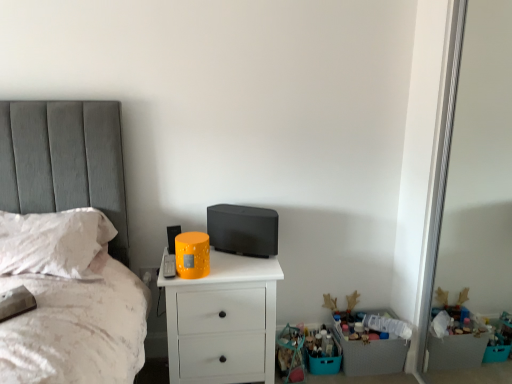
Question: From a real-world perspective, relative to white matte chest of drawers at center, is white soft pillow at left vertically above or below?

Choices:
 (A) above
 (B) below

Answer: (A)

Question: From the image's perspective, is white soft pillow at left located above or below white matte chest of drawers at center?

Choices:
 (A) below
 (B) above

Answer: (B)

Question: Estimate the real-world distances between objects in this image. Which object is farther from the plastic crate at lower right?

Choices:
 (A) white soft pillow at left
 (B) white matte chest of drawers at center

Answer: (A)

Question: Which object is the closest to the white soft pillow at left?

Choices:
 (A) plastic crate at lower right
 (B) white matte chest of drawers at center

Answer: (B)